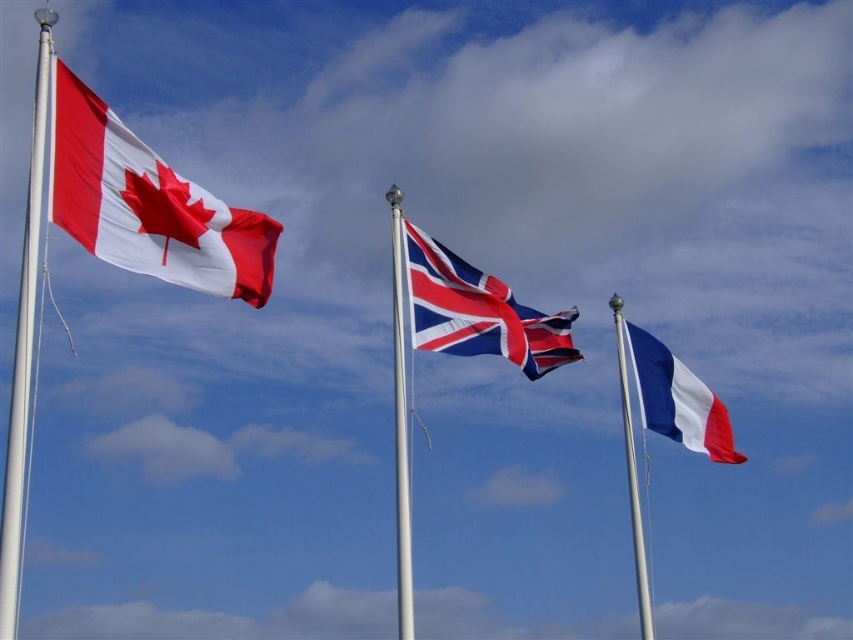
Question: Which of these objects is positioned closest to the smooth fabric flag at right?

Choices:
 (A) white metallic pole at left
 (B) metallic silver flag pole at center
 (C) blue fabric flag pole at right

Answer: (C)

Question: Is textured fabric flag at center to the right of white metallic pole at left from the viewer's perspective?

Choices:
 (A) yes
 (B) no

Answer: (A)

Question: Which point is farther to the camera?

Choices:
 (A) (13, 380)
 (B) (392, 280)

Answer: (B)

Question: Can you confirm if matte fabric maple leaf flag at upper left is bigger than metallic silver flag pole at center?

Choices:
 (A) yes
 (B) no

Answer: (B)

Question: Which is nearer to the textured fabric flag at center?

Choices:
 (A) smooth fabric flag at right
 (B) blue fabric flag pole at right

Answer: (A)

Question: Is textured fabric flag at center to the left of blue fabric flag pole at right from the viewer's perspective?

Choices:
 (A) yes
 (B) no

Answer: (A)